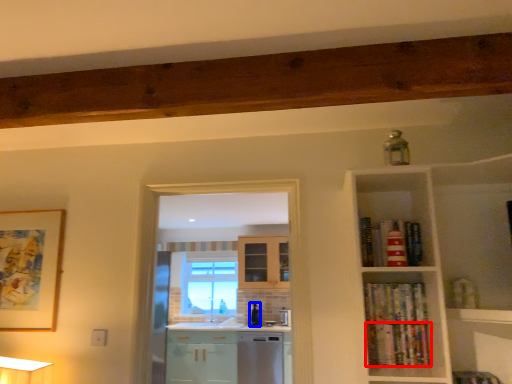
Question: Which object is further to the camera taking this photo, book (highlighted by a red box) or appliance (highlighted by a blue box)?

Choices:
 (A) book
 (B) appliance

Answer: (B)